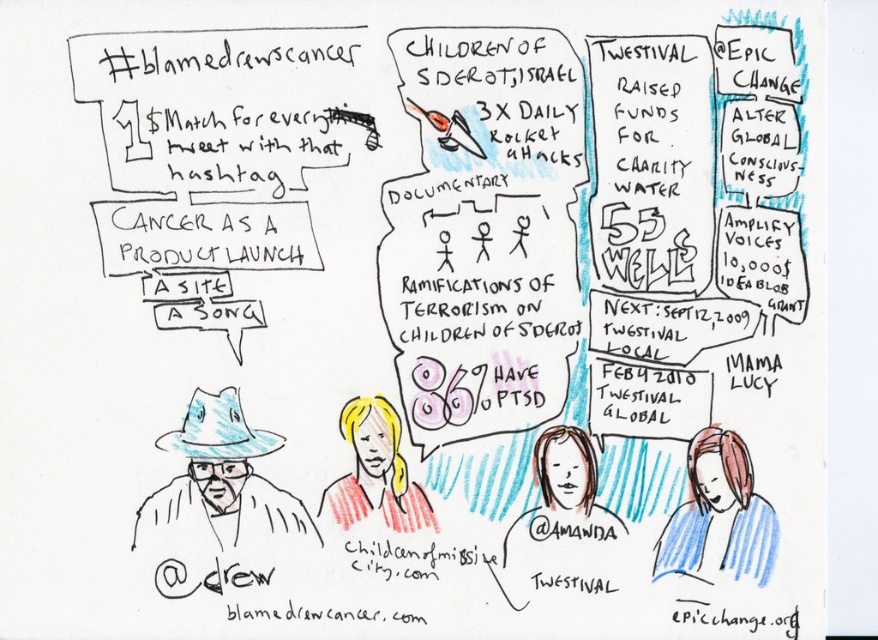
Based on the provided scene description, what does the point at coordinate (x=560, y=525) represent?

The point at coordinate (x=560, y=525) represents a smooth skin portrait located at the center of the image.

You are an observer looking at the image. There is a blue paper hat at left and a blonde hair at lower right. Which object is positioned higher in the image?

The blue paper hat at left is above the blonde hair at lower right, so it is positioned higher in the image.

Based on the photo, in the image, there are a smooth skin portrait at center and a blonde hair at center. Which object appears taller?

The smooth skin portrait at center is much taller than the blonde hair at center.